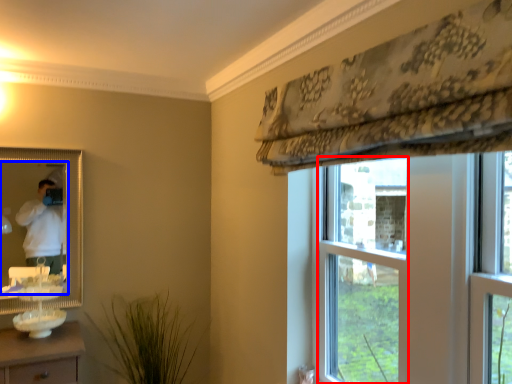
Question: Which of the following is the closest to the observer, bay window (highlighted by a red box) or mirror (highlighted by a blue box)?

Choices:
 (A) bay window
 (B) mirror

Answer: (A)